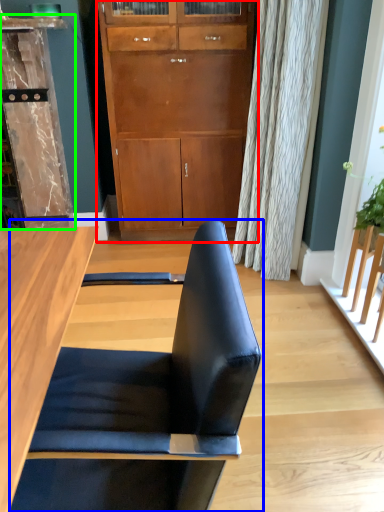
Question: Based on their relative distances, which object is farther from cabinetry (highlighted by a red box)? Choose from chair (highlighted by a blue box) and dresser (highlighted by a green box).

Choices:
 (A) chair
 (B) dresser

Answer: (A)